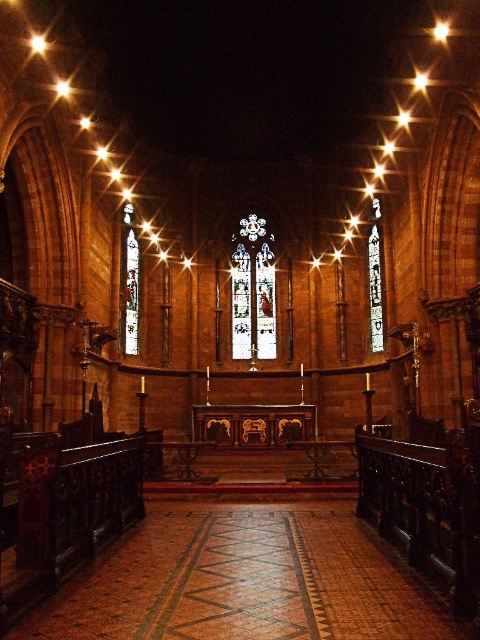
You are an interior designer planning to install a new lighting fixture in the church. You have two stained glass panels available, the clear glass stained glass at left and the transparent stained glass at center. According to their positions in the image, which one is positioned lower in the scene?

The clear glass stained glass at left is positioned below the transparent stained glass at center, so it is lower in the scene.

You are an architect examining the church interior. You need to determine the vertical positioning of the stained glass at center and the clear glass stained glass at left. Which one is placed higher up in the structure?

The stained glass at center is located above the clear glass stained glass at left, meaning it is placed higher up in the structure.